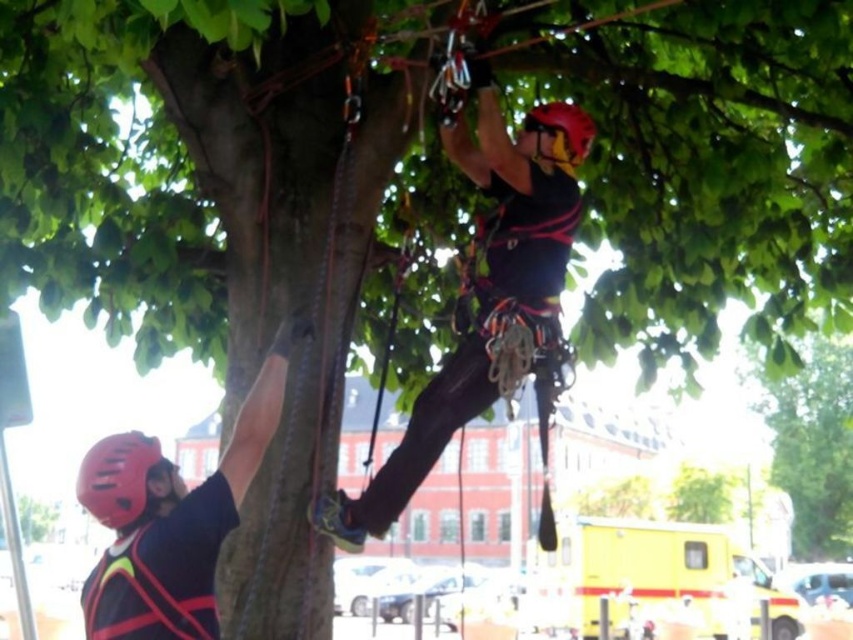
Question: Is green leafy tree at upper center positioned at the back of matte black helmet at lower left?

Choices:
 (A) no
 (B) yes

Answer: (B)

Question: Which object is farther from the camera taking this photo?

Choices:
 (A) green leafy tree at upper center
 (B) matte black helmet at upper center
 (C) red matte helmet at upper center

Answer: (A)

Question: Is matte black helmet at upper center thinner than matte black helmet at lower left?

Choices:
 (A) no
 (B) yes

Answer: (A)

Question: Which object appears farthest from the camera in this image?

Choices:
 (A) red matte safety vest at lower left
 (B) red matte helmet at upper center
 (C) matte black helmet at lower left
 (D) matte black helmet at upper center

Answer: (B)

Question: Does green leafy tree at upper center lie behind matte black helmet at lower left?

Choices:
 (A) yes
 (B) no

Answer: (A)

Question: Among these objects, which one is farthest from the camera?

Choices:
 (A) matte black helmet at lower left
 (B) matte black helmet at upper center
 (C) matte black helmet at left
 (D) red matte helmet at upper center

Answer: (D)